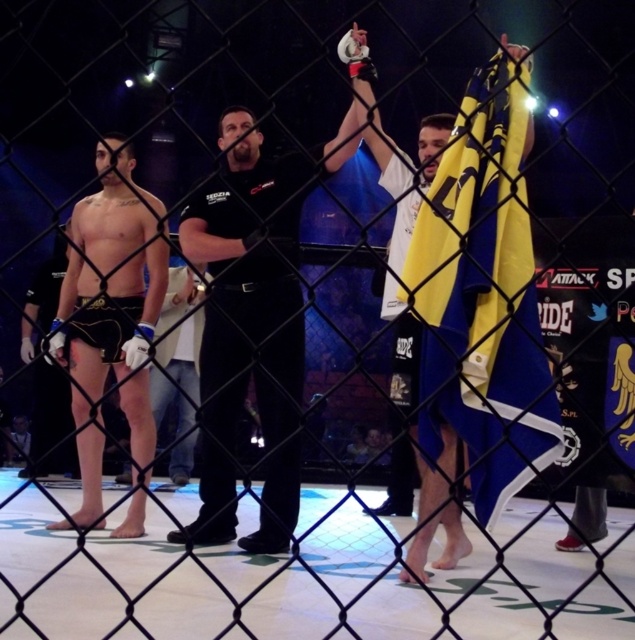
You are a photographer trying to capture a clear shot of both the black matte referee at center and the matte black shorts at center through the chain link fence. Which one will appear smaller in your photo?

The black matte referee at center will appear smaller in the photo since the description states that the black matte referee at center has a smaller size compared to the matte black shorts at center.

You are a photographer trying to capture a clear shot of both the black matte referee at center and the matte black shorts at center through the chain link fence. Since the fence is in the foreground, which of the two subjects might be easier to focus on due to their size?

The black matte referee at center is thinner than the matte black shorts at center, so the matte black shorts at center would be easier to focus on because it has a larger size, making it more distinct through the fence.